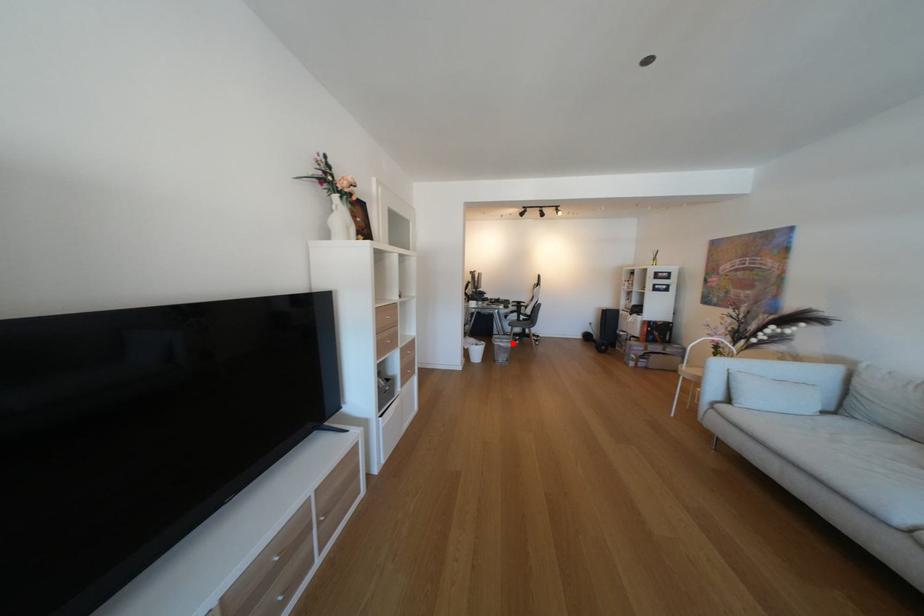
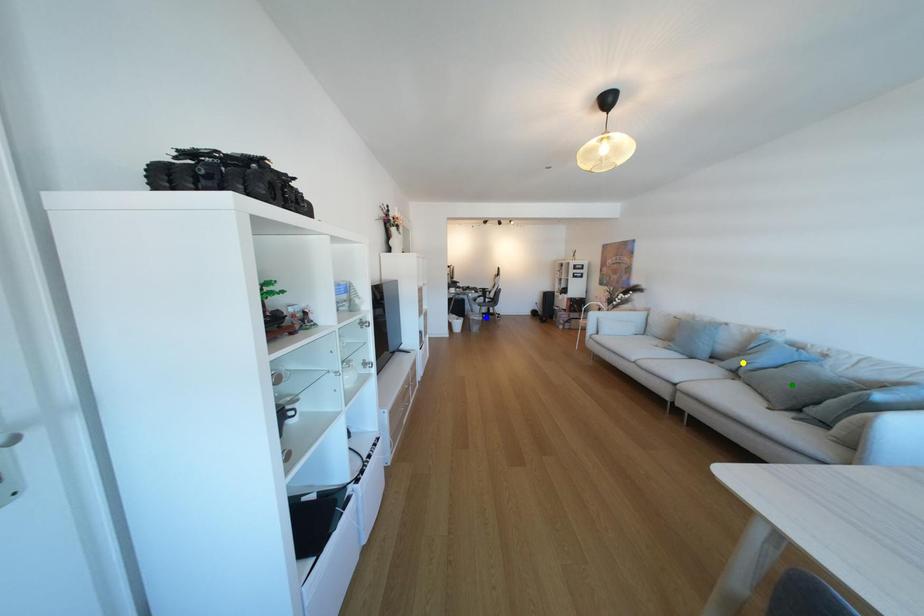
Question: I am providing you with two images of the same scene from different viewpoints. A red point is marked on the first image. You are given multiple points on the second image. Which spot in image 2 lines up with the point in image 1?

Choices:
 (A) yellow point
 (B) blue point
 (C) green point

Answer: (B)